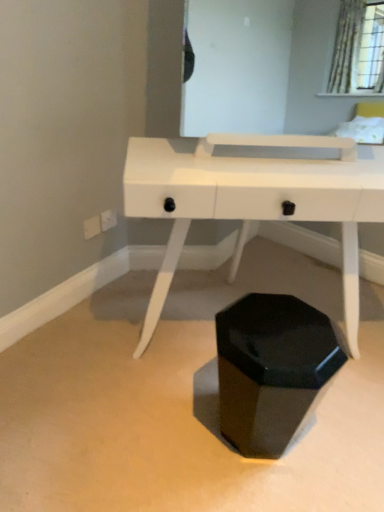
This screenshot has height=512, width=384. I want to click on vacant space that is in between white glossy desk at center and black glossy hexagonal at center, so click(x=266, y=421).